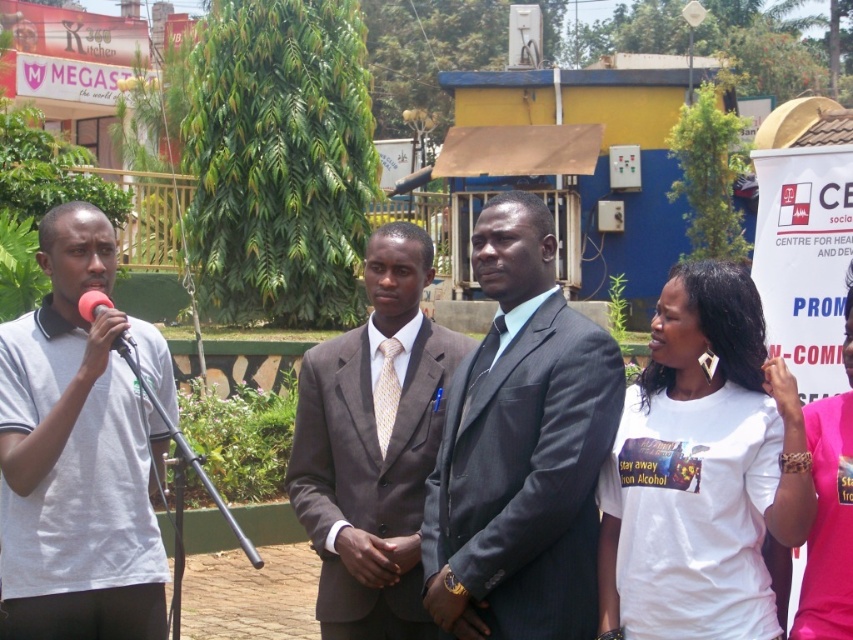
Question: Considering the real-world distances, which object is farthest from the matte black microphone at left?

Choices:
 (A) dark gray pinstripe suit at center
 (B) brown suit at center

Answer: (A)

Question: Is dark gray pinstripe suit at center below brown suit at center?

Choices:
 (A) yes
 (B) no

Answer: (B)

Question: Is dark gray pinstripe suit at center to the right of brown suit at center from the viewer's perspective?

Choices:
 (A) no
 (B) yes

Answer: (B)

Question: Which point appears closest to the camera in this image?

Choices:
 (A) pos(346,424)
 (B) pos(85,292)
 (C) pos(73,250)

Answer: (C)

Question: Can you confirm if brown suit at center is smaller than matte black microphone at left?

Choices:
 (A) no
 (B) yes

Answer: (A)

Question: Which object appears closest to the camera in this image?

Choices:
 (A) brown suit at center
 (B) dark gray pinstripe suit at center
 (C) white matte t-shirt at right
 (D) matte black microphone at left

Answer: (C)